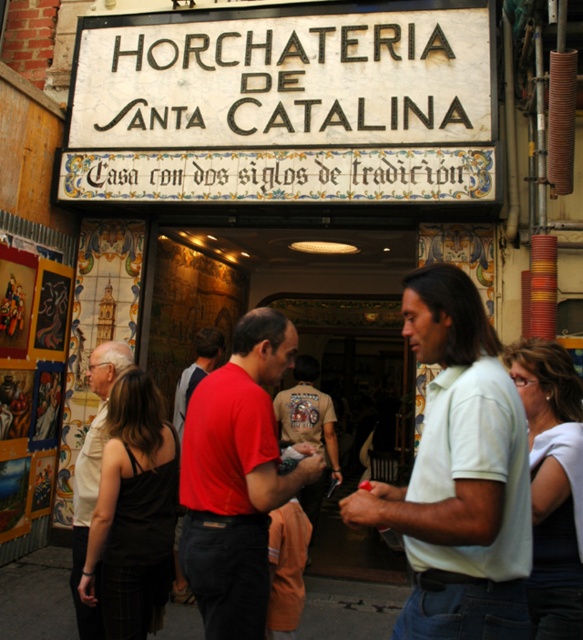
Does white painted wood sign at upper center appear on the left side of black fabric at center?

Indeed, white painted wood sign at upper center is positioned on the left side of black fabric at center.

Does white painted wood sign at upper center have a greater width compared to black fabric at center?

Indeed, white painted wood sign at upper center has a greater width compared to black fabric at center.

This screenshot has width=583, height=640. What do you see at coordinates (283, 106) in the screenshot? I see `white painted wood sign at upper center` at bounding box center [283, 106].

Where is `white painted wood sign at upper center`? This screenshot has width=583, height=640. white painted wood sign at upper center is located at coordinates (283, 106).

In the scene shown: Does white painted wood sign at upper center appear on the right side of light beige shirt at center?

Correct, you'll find white painted wood sign at upper center to the right of light beige shirt at center.

Which of these two, white painted wood sign at upper center or light beige shirt at center, stands shorter?

light beige shirt at center

Describe the element at coordinates (283, 106) in the screenshot. I see `white painted wood sign at upper center` at that location.

What are the coordinates of `white painted wood sign at upper center` in the screenshot? It's located at [283, 106].

Who is positioned more to the left, light beige shirt at center or khaki cotton shirt at center?

From the viewer's perspective, light beige shirt at center appears more on the left side.

Consider the image. Is light beige shirt at center shorter than khaki cotton shirt at center?

Correct, light beige shirt at center is not as tall as khaki cotton shirt at center.

Between point (87, 513) and point (303, 365), which one is positioned in front?

Point (87, 513) is more forward.

This screenshot has width=583, height=640. Identify the location of light beige shirt at center. (93, 474).